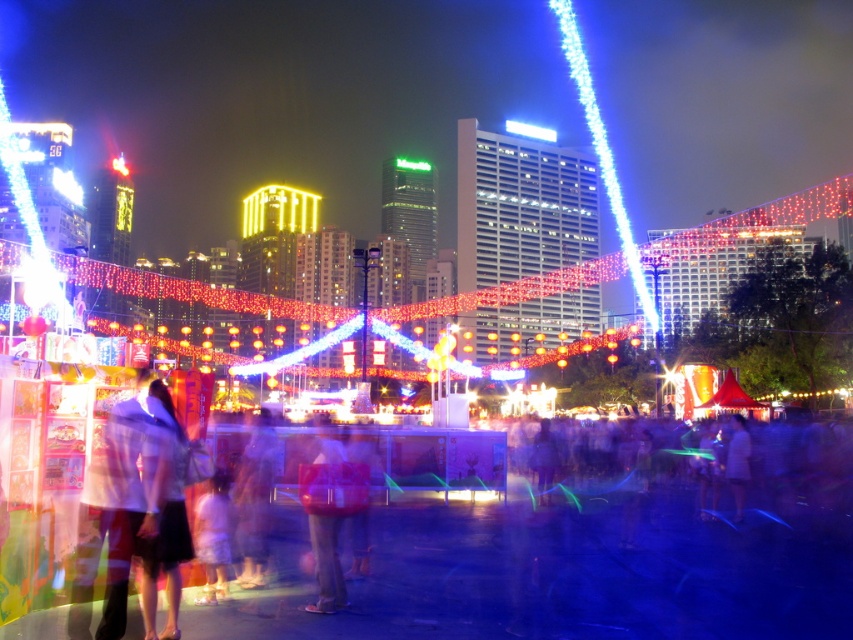
You are at a lively fair and see two people wearing a light pink fabric dress at center and a light brown fabric shirt at center. Which one is positioned more to the left?

The light pink fabric dress at center is positioned to the left of the light brown fabric shirt at center, so the light pink fabric dress at center is more to the left.

You are standing at the center of the event and see the light brown fabric shirt at center. If you walk straight ahead, will you eventually reach the bright blue light beam in the upper right?

The light brown fabric shirt at center is located at point (737, 461). Since the bright blue light beam is in the upper right, walking straight from the center would move towards the upper right direction, so yes, you would eventually reach the bright blue light beam in the upper right.

You are standing at the camera position and want to reach the point marked as point (x=316, y=454). If you can walk at a speed of 3 feet per second, how many seconds will it take you to reach that point?

The distance between point (x=316, y=454) and the camera is 222.94 feet. At a walking speed of 3 feet per second, it would take approximately 74.3 seconds to reach the point.